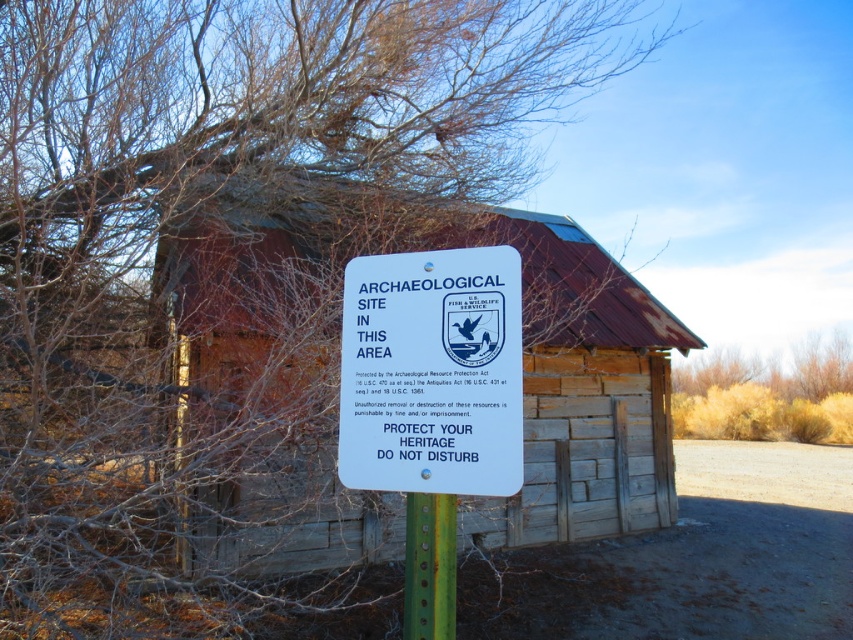
Can you confirm if weathered wood hut at center is thinner than green painted metal post at center?

Indeed, weathered wood hut at center has a lesser width compared to green painted metal post at center.

Who is positioned more to the right, weathered wood hut at center or green painted metal post at center?

green painted metal post at center is more to the right.

Is point (331, 518) less distant than point (434, 572)?

No, (331, 518) is behind (434, 572).

Identify the location of weathered wood hut at center. (337, 372).

Which is more to the left, brown dry bush at center or green painted metal post at center?

green painted metal post at center is more to the left.

Can you confirm if brown dry bush at center is positioned below green painted metal post at center?

Yes, brown dry bush at center is below green painted metal post at center.

Based on the photo, who is more forward, (737, 433) or (450, 497)?

Point (450, 497) is more forward.

The width and height of the screenshot is (853, 640). I want to click on brown dry bush at center, so click(769, 396).

Measure the distance between point [401,381] and camera.

Point [401,381] and camera are 8.65 feet apart.

What do you see at coordinates (432, 372) in the screenshot? I see `white plastic sign at center` at bounding box center [432, 372].

Between point (376, 292) and point (753, 400), which one is positioned in front?

Point (376, 292)

This screenshot has width=853, height=640. Identify the location of white plastic sign at center. (432, 372).